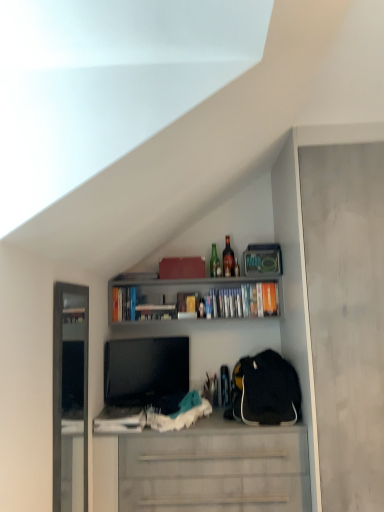
Question: From a real-world perspective, is hardcover books at upper center, arranged as the third book when viewed from the left, above or below white matte cabinet at center?

Choices:
 (A) below
 (B) above

Answer: (B)

Question: Based on their sizes in the image, would you say hardcover books at upper center, arranged as the third book when viewed from the left, is bigger or smaller than white matte cabinet at center?

Choices:
 (A) big
 (B) small

Answer: (B)

Question: Based on their relative distances, which object is farther from the white matte cabinet at center?

Choices:
 (A) matte gray cabinet at right
 (B) black fabric backpack at right
 (C) hardcover books at upper center, the third book positioned from the right
 (D) translucent glass bottle at upper center, which is counted as the 1th bottle, starting from the right
 (E) hardcover books at upper center, placed as the 1th book when sorted from right to left

Answer: (D)

Question: Which of these objects is positioned closest to the white matte cabinet at center?

Choices:
 (A) black glossy tv at center
 (B) hardcover books at upper center, arranged as the third book when viewed from the left
 (C) black fabric backpack at right
 (D) matte gray cabinet at right
 (E) green glass bottle at upper center, which appears as the first bottle when viewed from the left

Answer: (C)